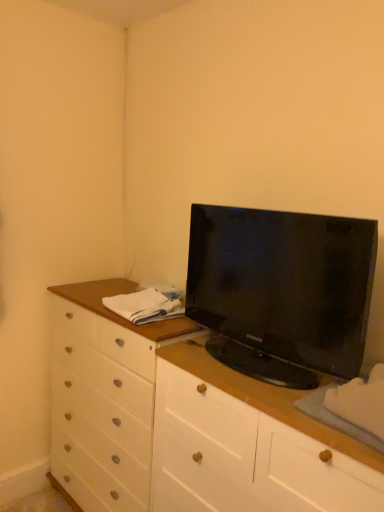
Describe the element at coordinates (282, 291) in the screenshot. I see `black glossy tv at center` at that location.

You are a GUI agent. You are given a task and a screenshot of the screen. Output one action in this format:
    pyautogui.click(x=<x>, y=<y>)
    Task: Click on the black glossy tv at center
    
    Given the screenshot: What is the action you would take?
    pyautogui.click(x=282, y=291)

Measure the distance between black glossy tv at center and camera.

black glossy tv at center is 3.66 feet away from camera.

Identify the location of black glossy tv at center. (282, 291).